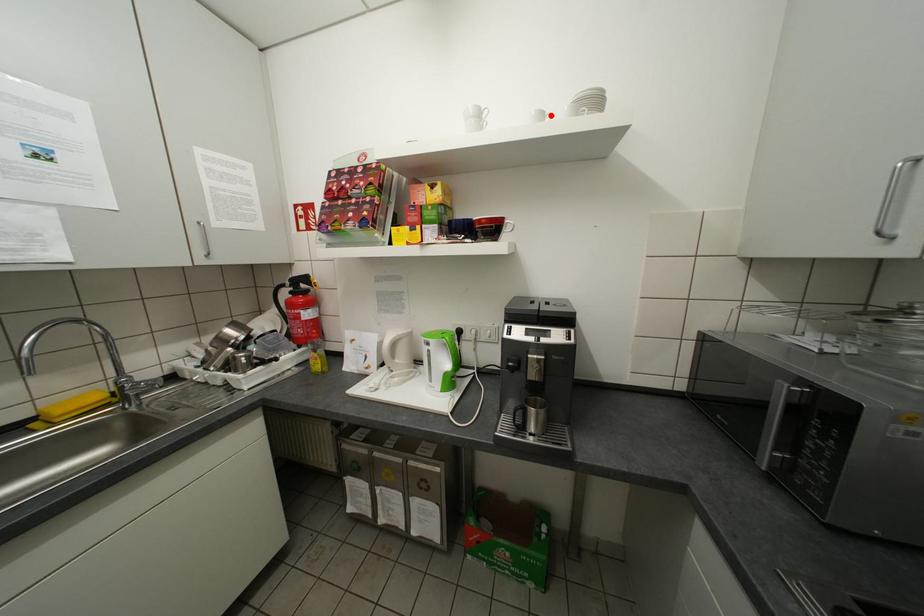
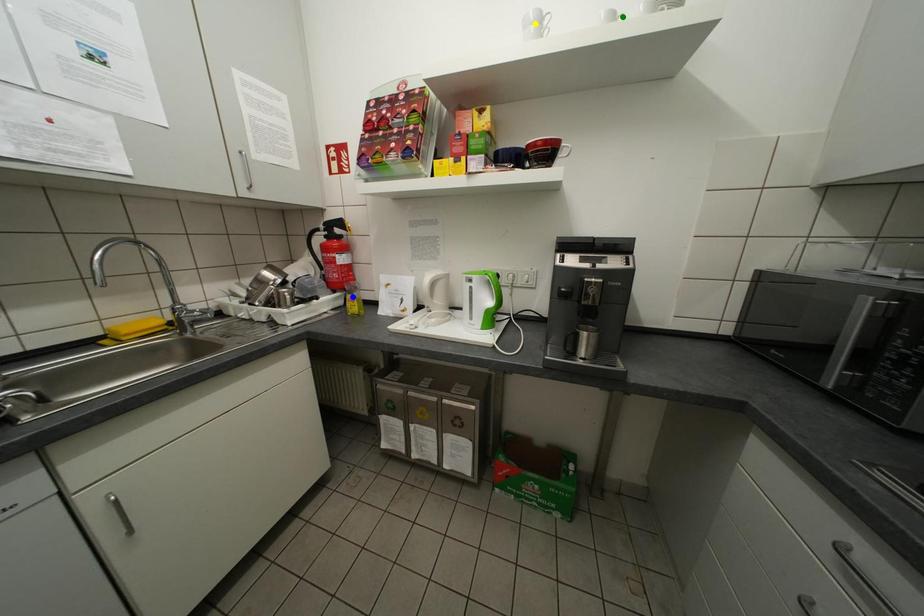
Question: I am providing you with two images of the same scene from different viewpoints. A red point is marked on the first image. You are given multiple points on the second image. In image 2, which mark is for the same physical point as the one in image 1?

Choices:
 (A) blue point
 (B) green point
 (C) yellow point

Answer: (B)